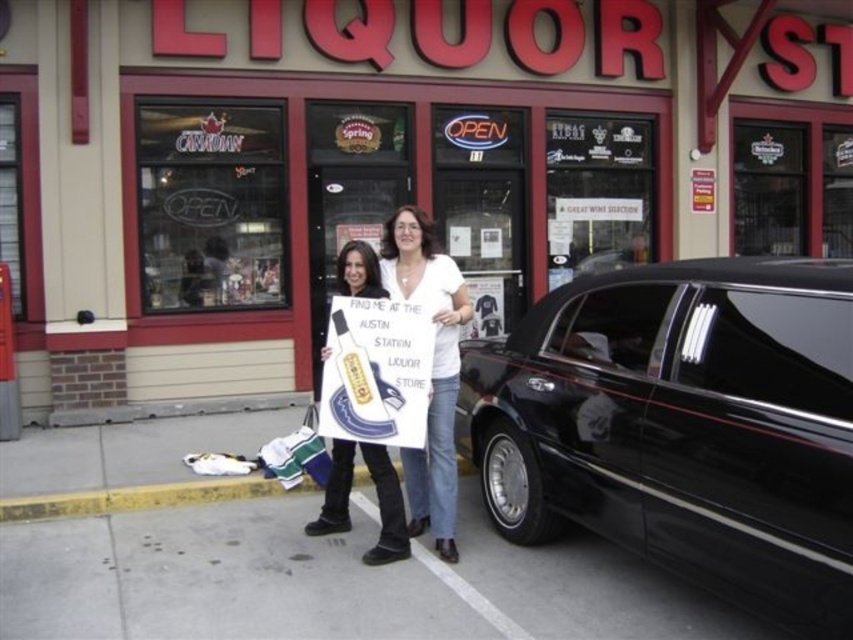
Which of these two, black glossy limousine at right or white cotton shirt at center, stands taller?

With more height is white cotton shirt at center.

Does black glossy limousine at right have a lesser height compared to white cotton shirt at center?

Yes, black glossy limousine at right is shorter than white cotton shirt at center.

Is point (550, 301) farther from camera compared to point (408, 467)?

No.

You are a GUI agent. You are given a task and a screenshot of the screen. Output one action in this format:
    pyautogui.click(x=<x>, y=<y>)
    Task: Click on the black glossy limousine at right
    This screenshot has width=853, height=640.
    Given the screenshot: What is the action you would take?
    pyautogui.click(x=683, y=426)

Who is more distant from viewer, (711,406) or (357,280)?

The point (357,280) is more distant.

Who is higher up, black glossy limousine at right or denim jeans at center?

Positioned higher is black glossy limousine at right.

Is point (664, 304) positioned after point (325, 490)?

No, it is not.

Image resolution: width=853 pixels, height=640 pixels. Identify the location of black glossy limousine at right. (683, 426).

Between point (541, 195) and point (809, 628), which one is positioned in front?

Positioned in front is point (809, 628).

Is matte black car at right to the right of black glossy limousine at right from the viewer's perspective?

A: Yes, matte black car at right is to the right of black glossy limousine at right.

The image size is (853, 640). In order to click on matte black car at right in this screenshot , I will do `click(381, 166)`.

Where is `matte black car at right`? matte black car at right is located at coordinates (381, 166).